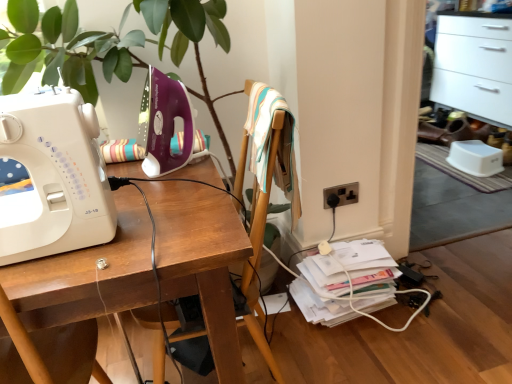
Question: Is the surface of wooden desk at center in direct contact with white glossy file cabinet at upper right?

Choices:
 (A) no
 (B) yes

Answer: (A)

Question: Is wooden desk at center shorter than white glossy file cabinet at upper right?

Choices:
 (A) no
 (B) yes

Answer: (B)

Question: Is wooden desk at center completely or partially outside of white glossy file cabinet at upper right?

Choices:
 (A) yes
 (B) no

Answer: (A)

Question: Can you confirm if wooden desk at center is smaller than white glossy file cabinet at upper right?

Choices:
 (A) yes
 (B) no

Answer: (A)

Question: Does wooden desk at center lie behind white glossy file cabinet at upper right?

Choices:
 (A) yes
 (B) no

Answer: (B)

Question: From the image's perspective, is wooden desk at center below white glossy file cabinet at upper right?

Choices:
 (A) yes
 (B) no

Answer: (A)

Question: Would you say purple plastic sewing machine at upper left, placed as the second sewing machine when sorted from front to back, is outside wooden chair at center?

Choices:
 (A) yes
 (B) no

Answer: (B)

Question: Is wooden chair at center completely or partially inside purple plastic sewing machine at upper left, placed as the second sewing machine when sorted from front to back?

Choices:
 (A) yes
 (B) no

Answer: (B)

Question: Is purple plastic sewing machine at upper left, placed as the second sewing machine when sorted from front to back, thinner than wooden chair at center?

Choices:
 (A) no
 (B) yes

Answer: (B)

Question: Considering the relative sizes of purple plastic sewing machine at upper left, placed as the second sewing machine when sorted from front to back, and wooden chair at center in the image provided, is purple plastic sewing machine at upper left, placed as the second sewing machine when sorted from front to back, smaller than wooden chair at center?

Choices:
 (A) yes
 (B) no

Answer: (A)

Question: Is purple plastic sewing machine at upper left, the 1th sewing machine when ordered from back to front, bigger than wooden chair at center?

Choices:
 (A) no
 (B) yes

Answer: (A)

Question: Considering the relative sizes of purple plastic sewing machine at upper left, the 1th sewing machine when ordered from back to front, and wooden chair at center in the image provided, is purple plastic sewing machine at upper left, the 1th sewing machine when ordered from back to front, shorter than wooden chair at center?

Choices:
 (A) no
 (B) yes

Answer: (B)

Question: Is purple plastic sewing machine at upper left, placed as the second sewing machine when sorted from front to back, shorter than black plastic electric outlet at lower right?

Choices:
 (A) no
 (B) yes

Answer: (A)